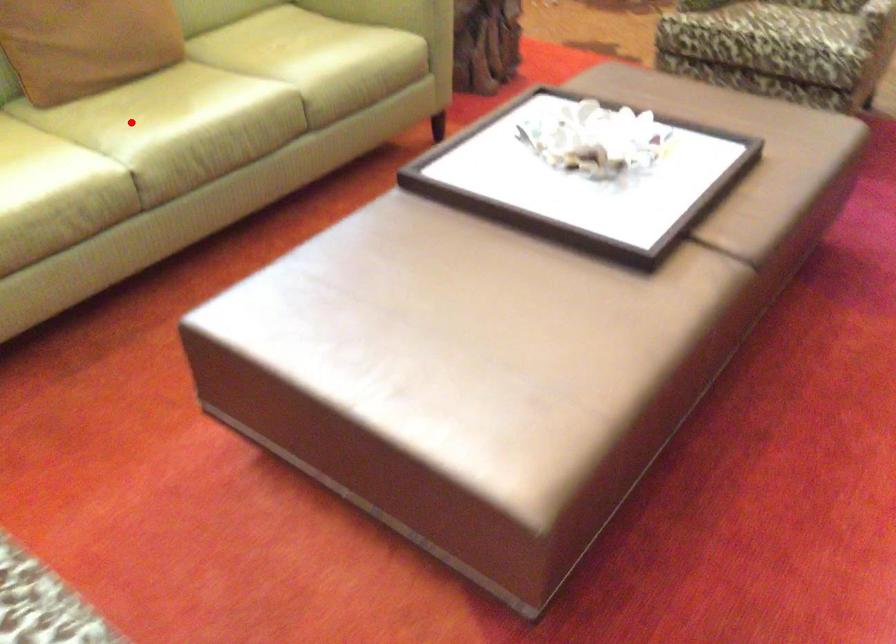
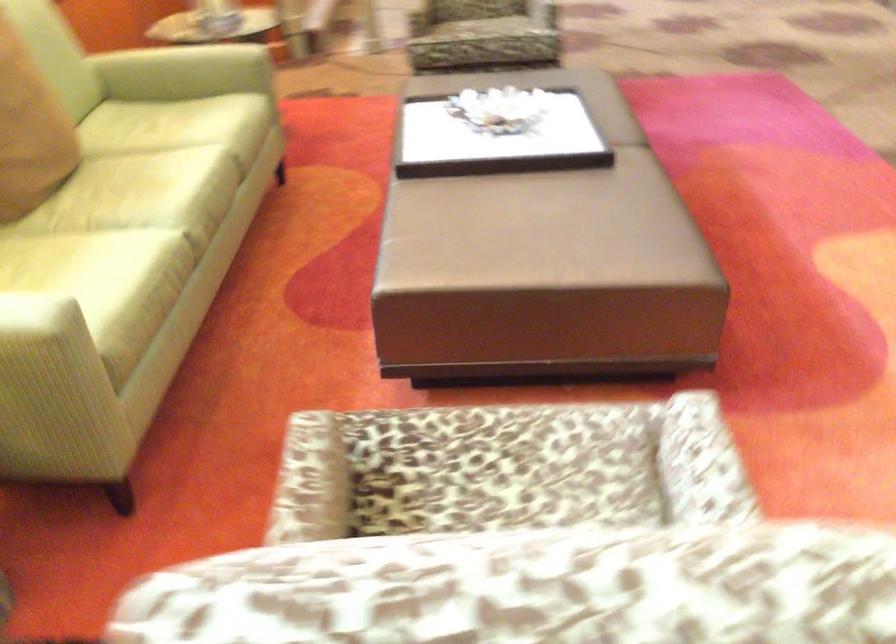
Question: I am providing you with two images of the same scene from different viewpoints. A red point is marked on the first image. Is the red point's position out of view in image 2?

Choices:
 (A) Yes
 (B) No

Answer: (B)